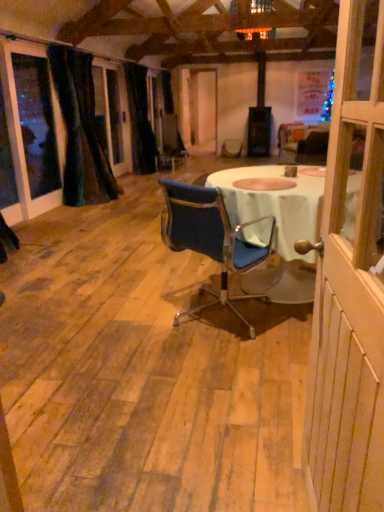
Question: Is velvet dark green curtain at left, placed as the 1th curtain when sorted from front to back, placed right next to black velvet curtain at left, which is counted as the 2th curtain, starting from the front?

Choices:
 (A) yes
 (B) no

Answer: (B)

Question: Considering the relative sizes of velvet dark green curtain at left, placed as the 1th curtain when sorted from front to back, and black velvet curtain at left, arranged as the 1th curtain when viewed from the back, in the image provided, is velvet dark green curtain at left, placed as the 1th curtain when sorted from front to back, wider than black velvet curtain at left, arranged as the 1th curtain when viewed from the back,?

Choices:
 (A) yes
 (B) no

Answer: (A)

Question: Is black velvet curtain at left, which is counted as the 2th curtain, starting from the front, at the back of velvet dark green curtain at left, placed as the 1th curtain when sorted from front to back?

Choices:
 (A) yes
 (B) no

Answer: (B)

Question: Does velvet dark green curtain at left, placed as the 1th curtain when sorted from front to back, appear on the right side of black velvet curtain at left, which is counted as the 2th curtain, starting from the front?

Choices:
 (A) no
 (B) yes

Answer: (A)

Question: Considering the relative sizes of velvet dark green curtain at left, placed as the 1th curtain when sorted from front to back, and black velvet curtain at left, which is counted as the 2th curtain, starting from the front, in the image provided, is velvet dark green curtain at left, placed as the 1th curtain when sorted from front to back, thinner than black velvet curtain at left, which is counted as the 2th curtain, starting from the front,?

Choices:
 (A) yes
 (B) no

Answer: (B)

Question: From the image's perspective, relative to black velvet curtain at left, arranged as the 1th curtain when viewed from the back, is blue fabric chair at center above or below?

Choices:
 (A) above
 (B) below

Answer: (B)

Question: Looking at their shapes, would you say blue fabric chair at center is wider or thinner than black velvet curtain at left, arranged as the 1th curtain when viewed from the back?

Choices:
 (A) wide
 (B) thin

Answer: (A)

Question: From a real-world perspective, relative to black velvet curtain at left, arranged as the 1th curtain when viewed from the back, is blue fabric chair at center vertically above or below?

Choices:
 (A) below
 (B) above

Answer: (A)

Question: Looking at the image, does blue fabric chair at center seem bigger or smaller compared to black velvet curtain at left, which is counted as the 2th curtain, starting from the front?

Choices:
 (A) big
 (B) small

Answer: (B)

Question: Is blue fabric chair at center bigger or smaller than white wood screen door at right?

Choices:
 (A) big
 (B) small

Answer: (A)

Question: From the image's perspective, is blue fabric chair at center located above or below white wood screen door at right?

Choices:
 (A) above
 (B) below

Answer: (A)

Question: Is blue fabric chair at center situated inside white wood screen door at right or outside?

Choices:
 (A) inside
 (B) outside

Answer: (B)

Question: Is point (205, 242) closer or farther from the camera than point (317, 264)?

Choices:
 (A) farther
 (B) closer

Answer: (A)

Question: Do you think velvet dark green curtain at left, which appears as the second curtain when viewed from the back, is within black velvet curtain at left, which is counted as the 2th curtain, starting from the front, or outside of it?

Choices:
 (A) outside
 (B) inside

Answer: (A)

Question: From their relative heights in the image, would you say velvet dark green curtain at left, which appears as the second curtain when viewed from the back, is taller or shorter than black velvet curtain at left, which is counted as the 2th curtain, starting from the front?

Choices:
 (A) tall
 (B) short

Answer: (B)